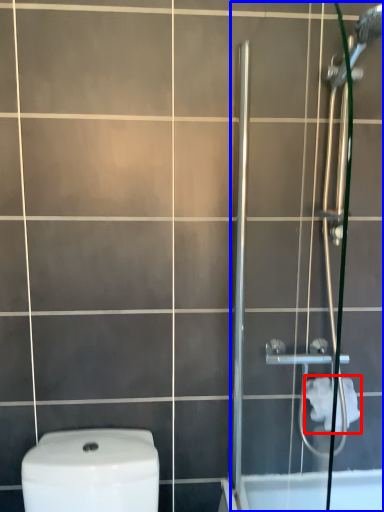
Question: Among these objects, which one is nearest to the camera, toilet paper (highlighted by a red box) or screen door (highlighted by a blue box)?

Choices:
 (A) toilet paper
 (B) screen door

Answer: (B)